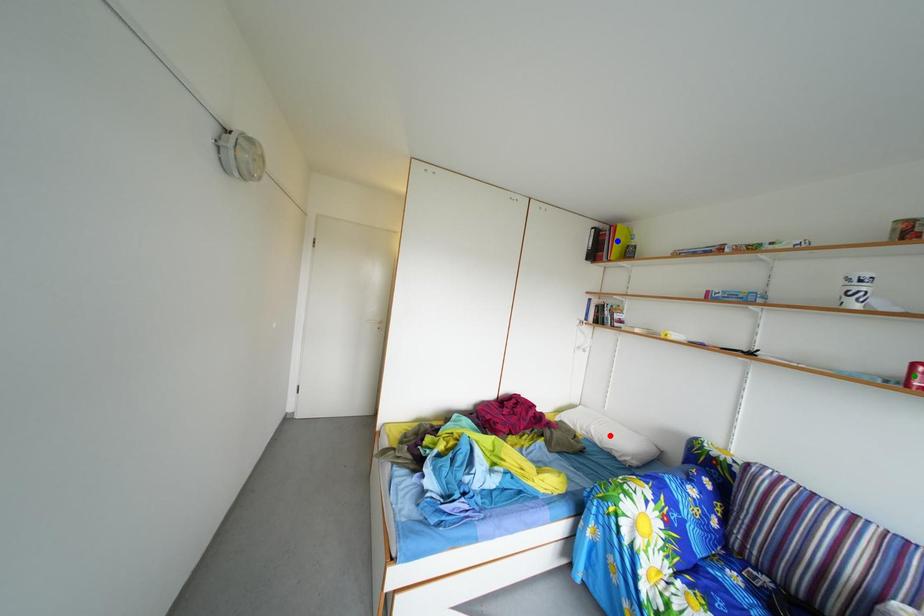
Order these from nearest to farthest:
red point | blue point | green point

green point, red point, blue point